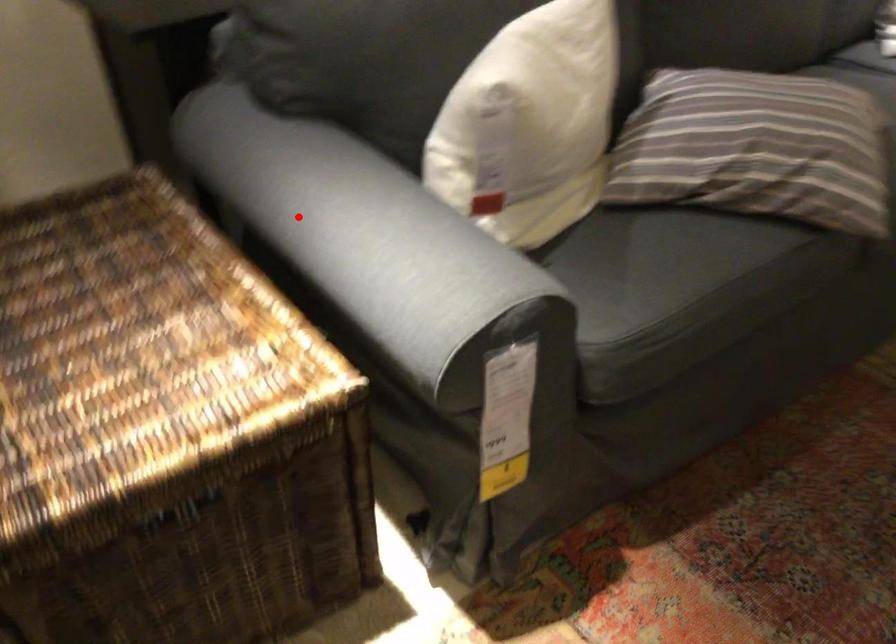
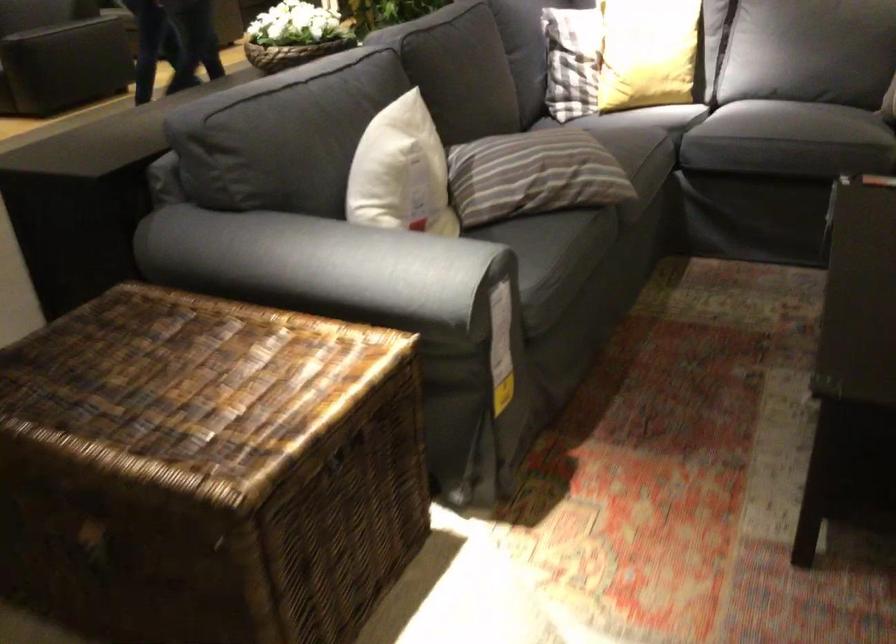
In the second image, find the point that corresponds to the highlighted location in the first image.

(304, 265)